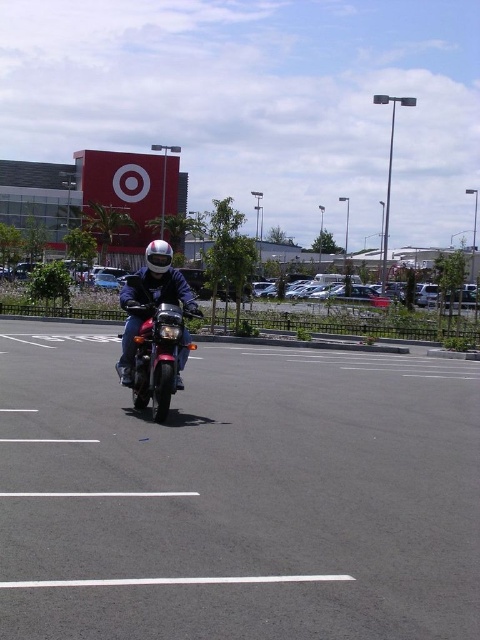
You are a pedestrian standing at the edge of the parking lot near the Target store. You see a shiny chrome motorbike at center and a shiny silver helmet at center. Which object is closer to you?

The shiny chrome motorbike at center is closer to you because the shiny silver helmet at center is behind it.

You are standing at the point labeled as point (237, 493) in the image. Based on the scene description, what is the surface you are standing on?

The point (237, 493) corresponds to the black asphalt parking lot at center, so you are standing on asphalt.

You are standing in the parking lot of the Target store and see two points marked on the ground. The first point is at coordinates point (423,566) and the second point is at point (160,410). Which point is closer to your current position if you are facing the Target building?

Point (423,566) is closer to the camera than point (160,410), so if you are facing the Target building, the point (423,566) would be closer to your current position.